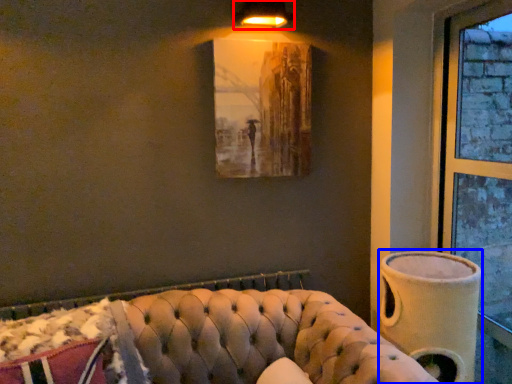
Question: Which point is closer to the camera, lamp (highlighted by a red box) or vase (highlighted by a blue box)?

Choices:
 (A) lamp
 (B) vase

Answer: (B)